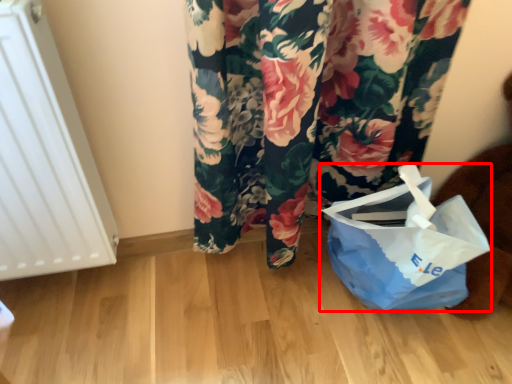
Question: From the image's perspective, what is the correct spatial positioning of plastic bag (annotated by the red box) in reference to radiator?

Choices:
 (A) below
 (B) above

Answer: (A)